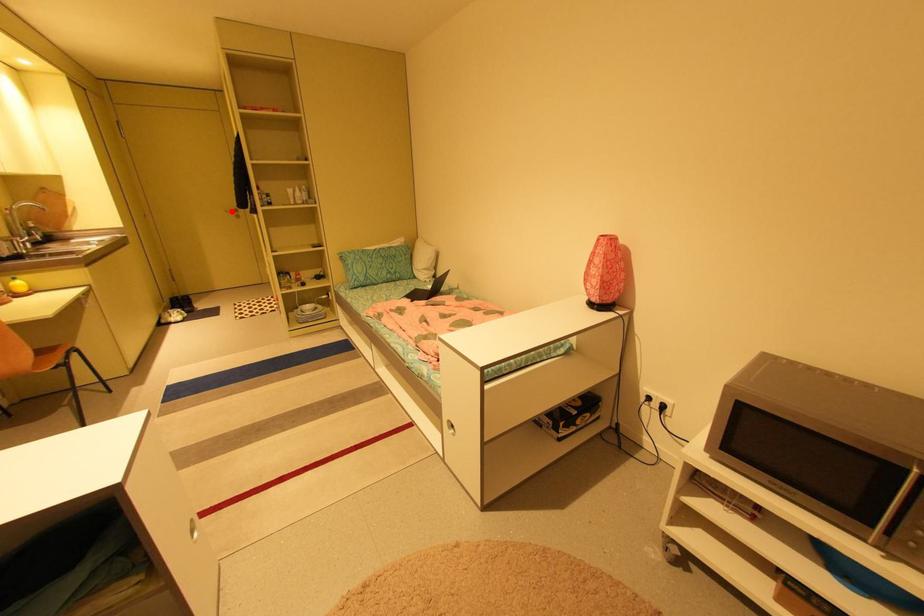
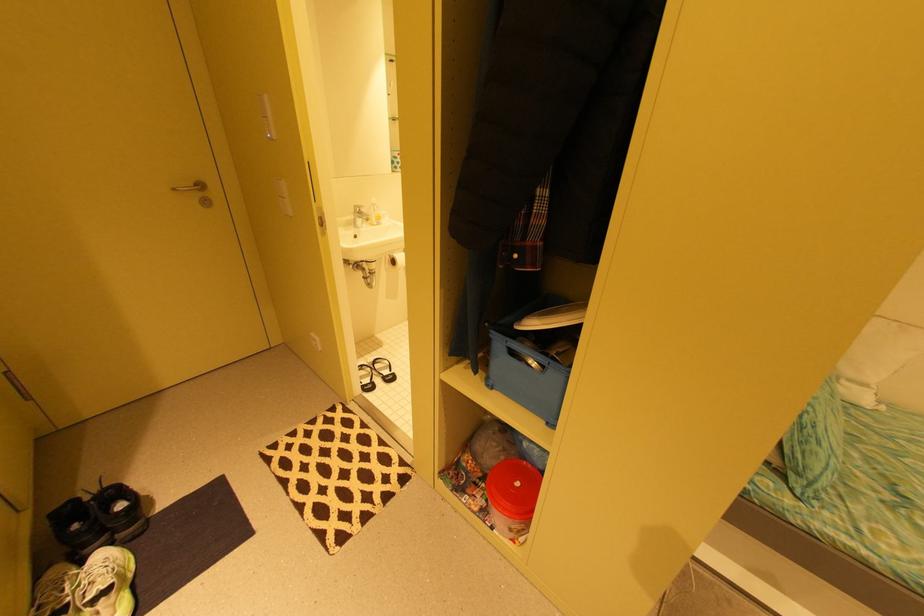
Find the pixel in the second image that matches the highlighted location in the first image.

(179, 190)